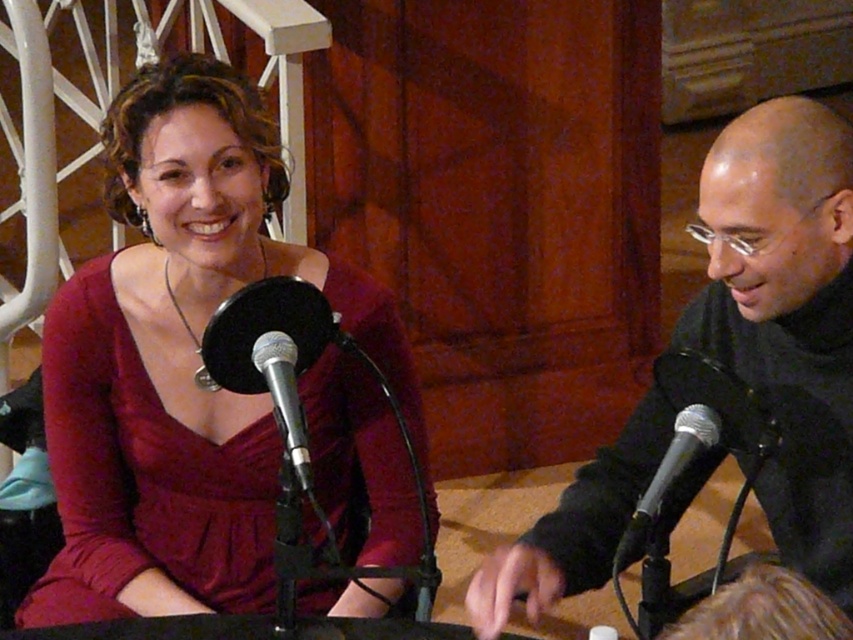
Question: Which object is farther from the camera taking this photo?

Choices:
 (A) black metallic microphone at lower right
 (B) matte red dress at center
 (C) black matte jacket at right

Answer: (B)

Question: Which point is farther to the camera?

Choices:
 (A) (221, 262)
 (B) (294, 381)
 (C) (569, 540)

Answer: (A)

Question: Which object is positioned farthest from the matte red dress at center?

Choices:
 (A) black metallic microphone at lower right
 (B) silver metallic microphone at center

Answer: (A)

Question: Is matte red dress at center to the left of silver metallic microphone at center from the viewer's perspective?

Choices:
 (A) yes
 (B) no

Answer: (A)

Question: Is matte red dress at center to the left of black matte jacket at right from the viewer's perspective?

Choices:
 (A) no
 (B) yes

Answer: (B)

Question: Is matte red dress at center to the right of silver metallic microphone at center from the viewer's perspective?

Choices:
 (A) no
 (B) yes

Answer: (A)